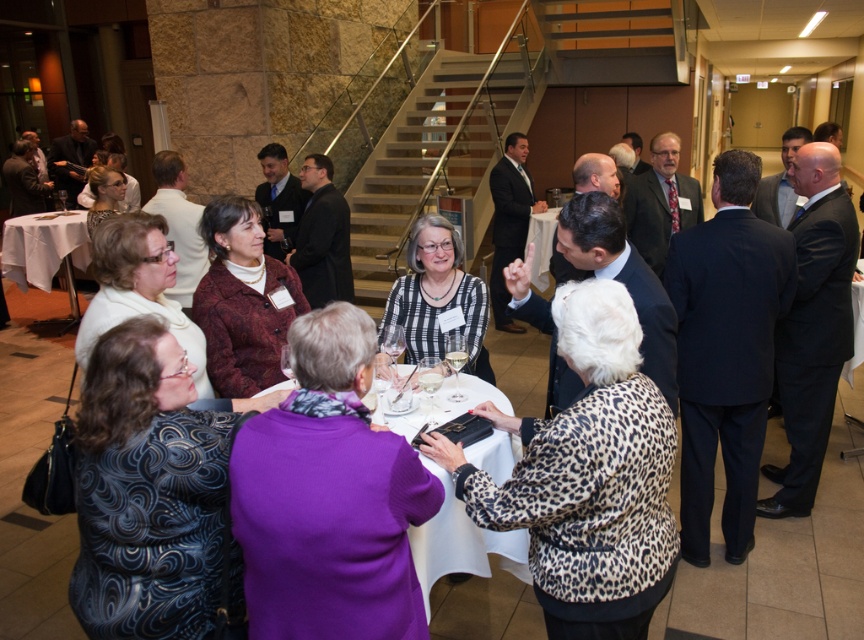
Question: Considering the relative positions of white cloth at center and white cloth table at lower left in the image provided, where is white cloth at center located with respect to white cloth table at lower left?

Choices:
 (A) below
 (B) above

Answer: (A)

Question: Which point appears farthest from the camera in this image?

Choices:
 (A) (68, 278)
 (B) (458, 403)

Answer: (A)

Question: Does white cloth at center appear under white cloth table at lower left?

Choices:
 (A) no
 (B) yes

Answer: (B)

Question: Does white cloth at center appear over white cloth table at lower left?

Choices:
 (A) yes
 (B) no

Answer: (B)